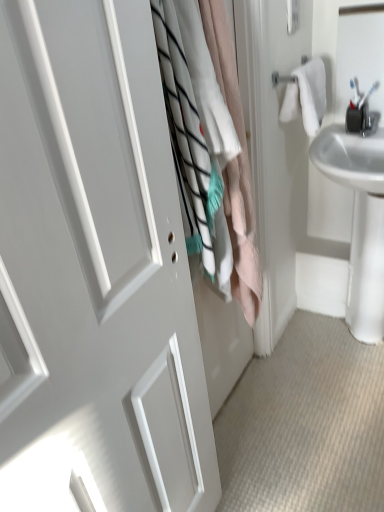
Question: Does white matte door at center have a greater height compared to white cotton bath towel at upper right?

Choices:
 (A) no
 (B) yes

Answer: (B)

Question: Considering the relative positions of white matte door at center and white cotton bath towel at upper right in the image provided, is white matte door at center behind white cotton bath towel at upper right?

Choices:
 (A) no
 (B) yes

Answer: (A)

Question: Does white matte door at center have a smaller size compared to white cotton bath towel at upper right?

Choices:
 (A) no
 (B) yes

Answer: (A)

Question: From the image's perspective, does white matte door at center appear lower than white cotton bath towel at upper right?

Choices:
 (A) yes
 (B) no

Answer: (A)

Question: From the image's perspective, is white matte door at center over white cotton bath towel at upper right?

Choices:
 (A) yes
 (B) no

Answer: (B)

Question: Considering the relative sizes of white matte door at center and white cotton bath towel at upper right in the image provided, is white matte door at center thinner than white cotton bath towel at upper right?

Choices:
 (A) yes
 (B) no

Answer: (A)

Question: Is white cotton bath towel at upper right placed right next to white cotton laundry at center?

Choices:
 (A) yes
 (B) no

Answer: (B)

Question: Is white cotton bath towel at upper right behind white cotton laundry at center?

Choices:
 (A) yes
 (B) no

Answer: (A)

Question: Would you say white cotton laundry at center is part of white cotton bath towel at upper right's contents?

Choices:
 (A) yes
 (B) no

Answer: (B)

Question: Considering the relative sizes of white cotton bath towel at upper right and white cotton laundry at center in the image provided, is white cotton bath towel at upper right taller than white cotton laundry at center?

Choices:
 (A) yes
 (B) no

Answer: (B)

Question: Can you confirm if white cotton bath towel at upper right is shorter than white cotton laundry at center?

Choices:
 (A) no
 (B) yes

Answer: (B)

Question: Does white cotton bath towel at upper right have a larger size compared to white cotton laundry at center?

Choices:
 (A) yes
 (B) no

Answer: (B)

Question: Is white cotton laundry at center at the back of white glossy sink at right?

Choices:
 (A) yes
 (B) no

Answer: (B)